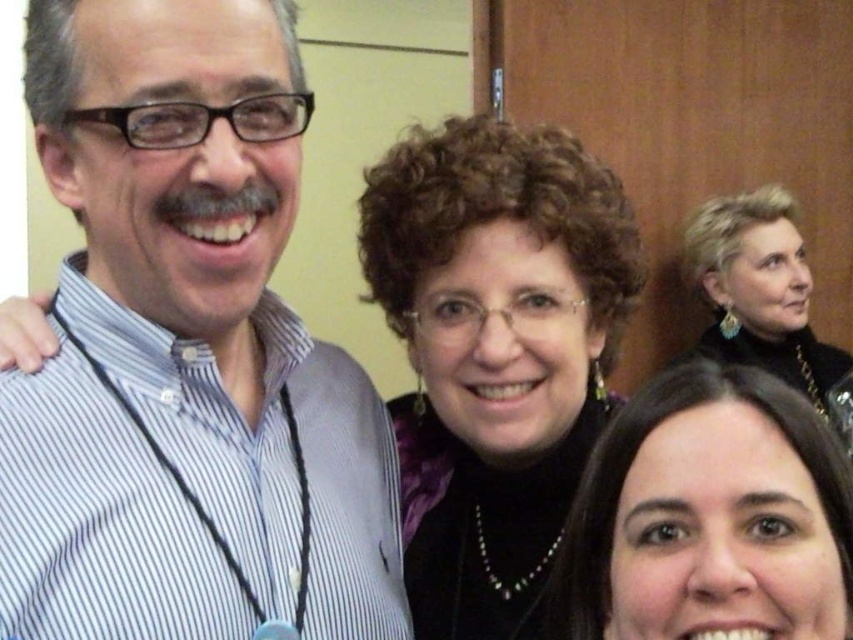
You are trying to determine the relative positions of two points in the image. The first point is at coordinate point (444, 625) and the second is at point (726, 353). Which point is closer to you?

Point (444, 625) is closer to the viewer than point (726, 353).

You are at a networking event and want to approach the dark brown hair at lower right and the satin black dress at upper right. Which one should you walk towards first if you want to greet them in the order from closest to farthest?

You should first greet the dark brown hair at lower right because it is closer to you than the satin black dress at upper right.

Based on the scene description, where is the black velvet blouse at center located in the image?

The black velvet blouse at center is located at point 0.552 in the x coordinate and 0.580 in the y coordinate.